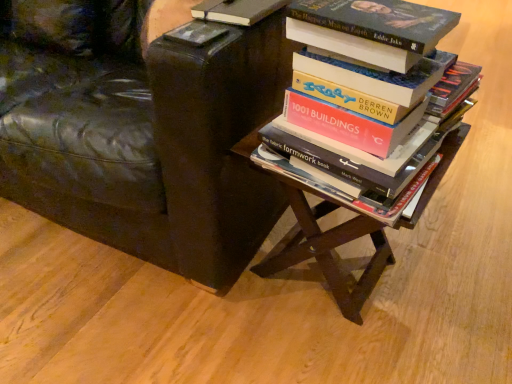
Question: Considering the relative sizes of hardcover book at center, the first book from the bottom, and black leather chair at upper left in the image provided, is hardcover book at center, the first book from the bottom, bigger than black leather chair at upper left?

Choices:
 (A) yes
 (B) no

Answer: (B)

Question: Can you confirm if hardcover book at center, the first book from the bottom, is wider than black leather chair at upper left?

Choices:
 (A) no
 (B) yes

Answer: (A)

Question: Are hardcover book at center, the second book in the top-to-bottom sequence, and black leather chair at upper left making contact?

Choices:
 (A) yes
 (B) no

Answer: (B)

Question: From a real-world perspective, is hardcover book at center, the second book in the top-to-bottom sequence, under black leather chair at upper left?

Choices:
 (A) no
 (B) yes

Answer: (A)

Question: From the image's perspective, is hardcover book at center, the second book in the top-to-bottom sequence, on top of black leather chair at upper left?

Choices:
 (A) yes
 (B) no

Answer: (B)

Question: In the image, is black leather chair at upper left positioned in front of or behind hardcover book at center, the first book from the bottom?

Choices:
 (A) behind
 (B) front

Answer: (A)

Question: Based on their sizes in the image, would you say black leather chair at upper left is bigger or smaller than hardcover book at center, the second book in the top-to-bottom sequence?

Choices:
 (A) small
 (B) big

Answer: (B)

Question: Does point (209, 102) appear closer or farther from the camera than point (362, 160)?

Choices:
 (A) closer
 (B) farther

Answer: (B)

Question: Is black leather chair at upper left inside the boundaries of hardcover book at center, the first book from the bottom, or outside?

Choices:
 (A) inside
 (B) outside

Answer: (B)

Question: Is point coord(287,256) closer or farther from the camera than point coord(133,240)?

Choices:
 (A) farther
 (B) closer

Answer: (A)

Question: From a real-world perspective, is wooden table at center above or below black leather chair at upper left?

Choices:
 (A) below
 (B) above

Answer: (A)

Question: In terms of height, does wooden table at center look taller or shorter compared to black leather chair at upper left?

Choices:
 (A) short
 (B) tall

Answer: (A)

Question: Based on their positions, is wooden table at center located to the left or right of black leather chair at upper left?

Choices:
 (A) left
 (B) right

Answer: (B)

Question: In terms of size, does wooden table at center appear bigger or smaller than hardcover book at upper left, acting as the second book starting from the bottom?

Choices:
 (A) small
 (B) big

Answer: (B)

Question: Visually, is wooden table at center positioned to the left or to the right of hardcover book at upper left, acting as the second book starting from the bottom?

Choices:
 (A) right
 (B) left

Answer: (A)